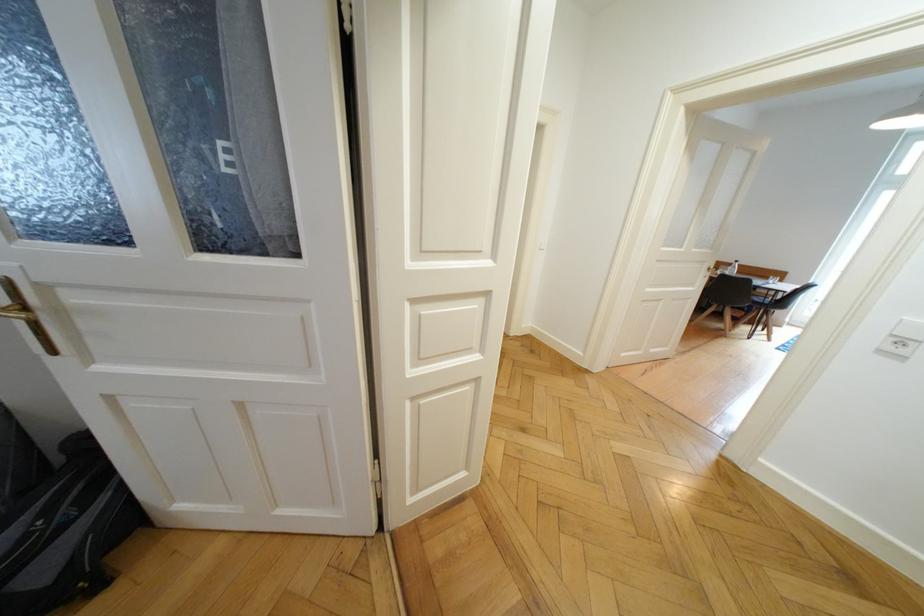
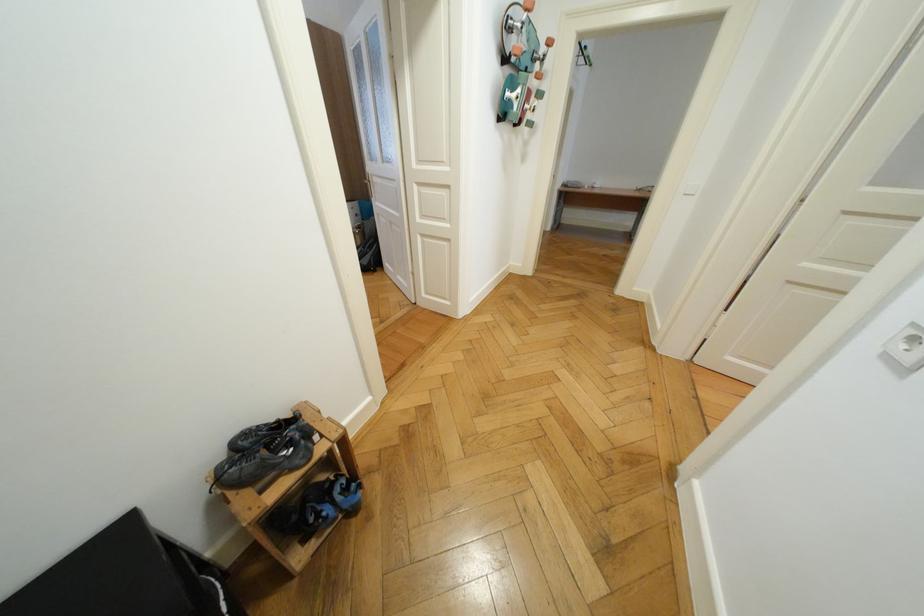
In the second image, find the point that corresponds to (x=550, y=251) in the first image.

(695, 196)